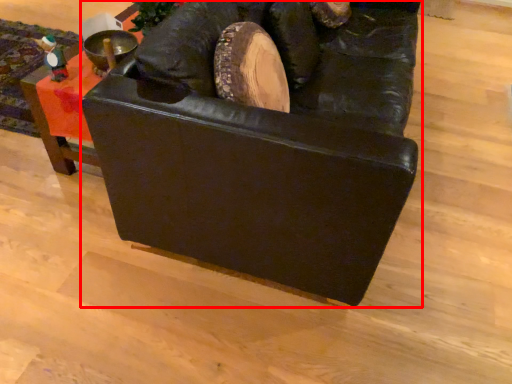
Question: From the image, what is the correct spatial relationship of furniture (annotated by the red box) in relation to furniture?

Choices:
 (A) right
 (B) left

Answer: (A)